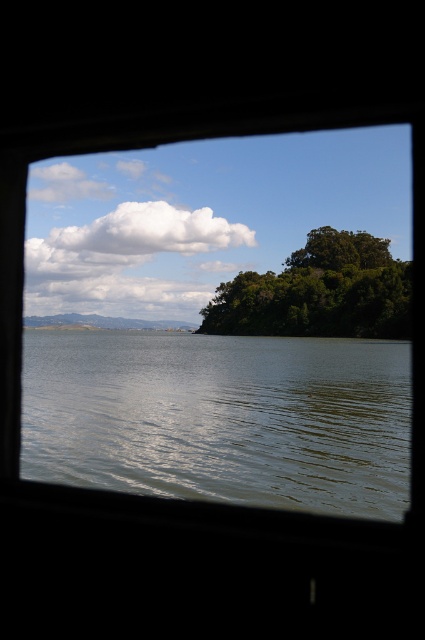
You are standing in a room with a transparent glass window at center. You want to place a 12 feet long ladder against the window to clean it. Is the ladder long enough to reach the bottom of the window?

The transparent glass window at center and viewer are 14.45 feet apart from each other. The ladder is 12 feet long, which is shorter than the distance to the window. Therefore, the ladder is not long enough to reach the bottom of the transparent glass window at center.

You are standing in a room with a window. You see a point at coordinates (221, 323). What object is located at that point?

The point at coordinates (221, 323) indicates the transparent glass window at center.

You are standing in a room and looking through the transparent glass window at center. If you want to place a small sticker exactly at the center of the window, where would you place it?

You should place the sticker at the point with coordinates 0.505 on the x axis and 0.522 on the y axis, which corresponds to the 2D location of the transparent glass window at center.